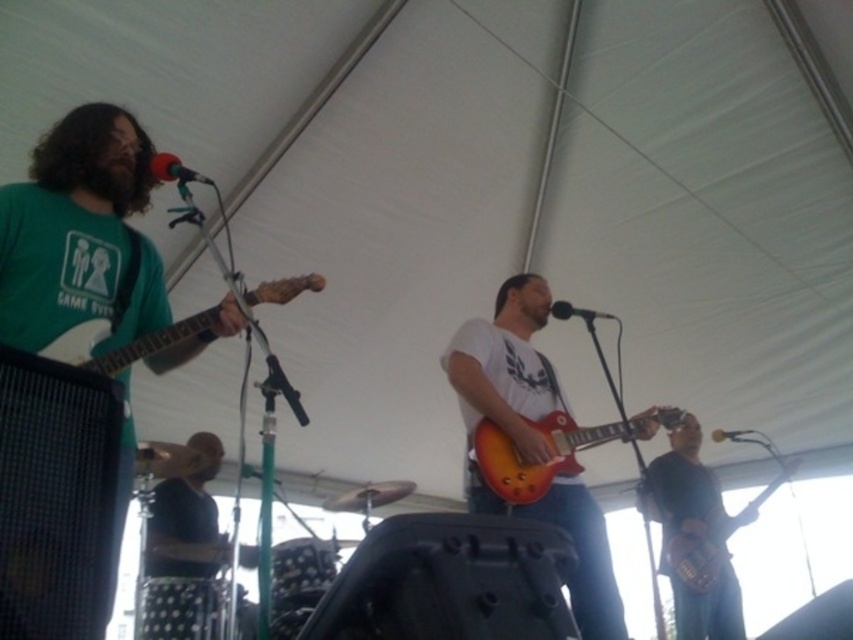
Can you confirm if matte green t-shirt at left is smaller than sunburst wood electric guitar at center?

Actually, matte green t-shirt at left might be larger than sunburst wood electric guitar at center.

Who is higher up, matte green t-shirt at left or sunburst wood electric guitar at center?

matte green t-shirt at left is above.

Where is `matte green t-shirt at left`? This screenshot has height=640, width=853. matte green t-shirt at left is located at coordinates pos(80,234).

Is matte orange guitar at center shorter than black matte microphone at upper left?

Incorrect, matte orange guitar at center's height does not fall short of black matte microphone at upper left's.

From the picture: Which of these two, matte orange guitar at center or black matte microphone at upper left, stands shorter?

black matte microphone at upper left is shorter.

Is point (582, 541) in front of point (155, 172)?

That is False.

The image size is (853, 640). What are the coordinates of `matte orange guitar at center` in the screenshot? It's located at (506, 365).

Can you confirm if sunburst wood electric guitar at center is shorter than black matte microphone at center?

Incorrect, sunburst wood electric guitar at center's height does not fall short of black matte microphone at center's.

Based on the photo, who is more forward, (582, 445) or (554, 316)?

Point (582, 445) is in front.

The image size is (853, 640). Identify the location of sunburst wood electric guitar at center. (549, 451).